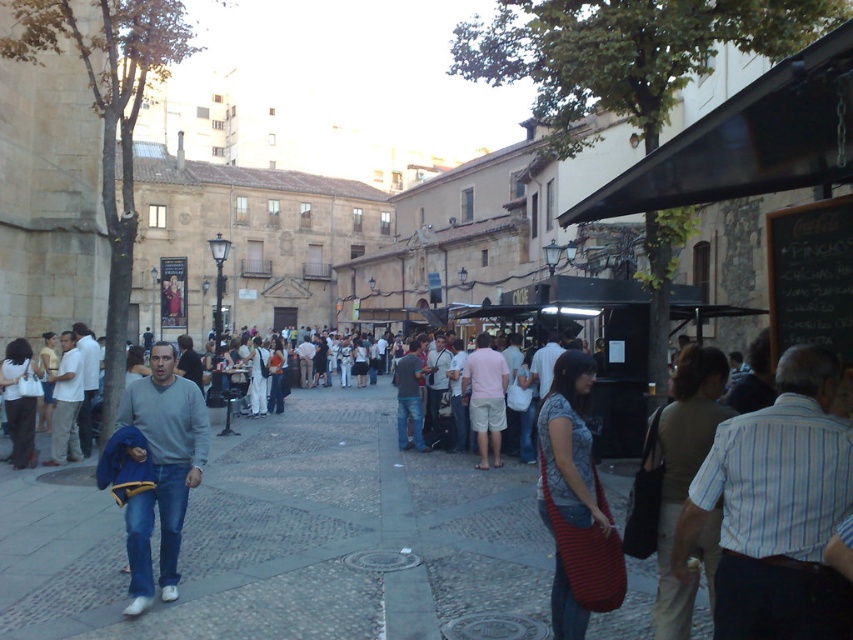
Question: Does gray sweater at center come in front of green fabric shirt at center?

Choices:
 (A) yes
 (B) no

Answer: (A)

Question: Which object is closer to the camera taking this photo?

Choices:
 (A) jeans at center
 (B) gray sweater at center

Answer: (B)

Question: Does green fabric shirt at center appear on the right side of jeans at center?

Choices:
 (A) no
 (B) yes

Answer: (B)

Question: Is green fabric shirt at center below light gray sweater at left?

Choices:
 (A) no
 (B) yes

Answer: (B)

Question: Which object is the closest to the light gray sweater at left?

Choices:
 (A) jeans at center
 (B) gray cobblestone pavement at center
 (C) gray sweater at center
 (D) striped fabric bag at lower right

Answer: (A)

Question: Which object is positioned closest to the striped fabric bag at lower right?

Choices:
 (A) gray cobblestone pavement at center
 (B) light gray sweater at left
 (C) green fabric shirt at center

Answer: (C)